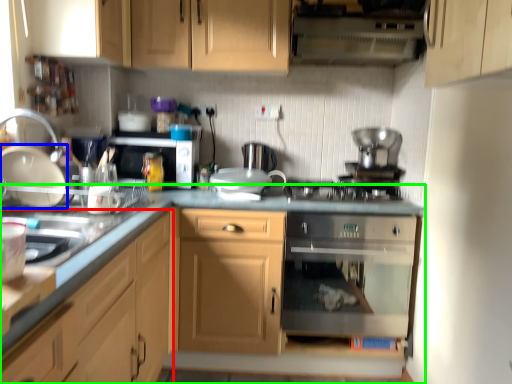
Question: Which is farther away from cabinetry (highlighted by a red box)? kitchen appliance (highlighted by a blue box) or cabinetry (highlighted by a green box)?

Choices:
 (A) kitchen appliance
 (B) cabinetry

Answer: (A)